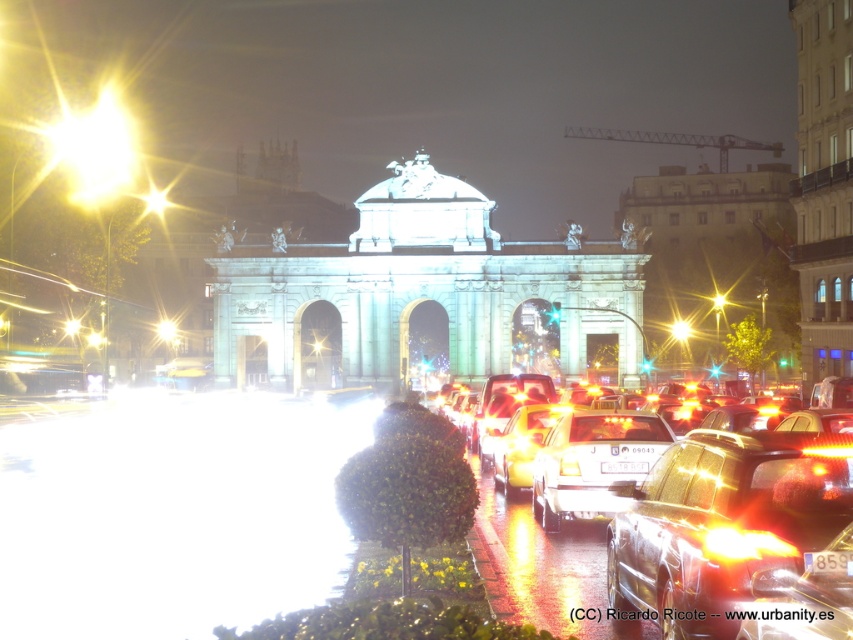
You are a pedestrian standing at the intersection near the point marked by point (x=726, y=522). You want to cross the street to reach the grand illuminated archway. Is there a clear path to the archway from your current position?

The point (x=726, y=522) marks the metallic silver sedan at center, so the metallic silver sedan at center is blocking your path to the archway. You should wait for the sedan to move before attempting to cross.

You are a photographer standing in front of the grand illuminated archway. You notice two cars at the center of the image, a metallic silver car at center and a shiny metallic car at center. Which car is positioned lower in the frame?

The metallic silver car at center is positioned lower than the shiny metallic car at center.

From the picture: You are a photographer trying to capture a clear image of both the metallic silver sedan at center and the shiny orange car at center in the busy street. Considering their sizes, which car would require a wider angle to fit entirely in your photo?

The metallic silver sedan at center has a larger size compared to the shiny orange car at center, so you would need a wider angle to capture the metallic silver sedan at center in its entirety.